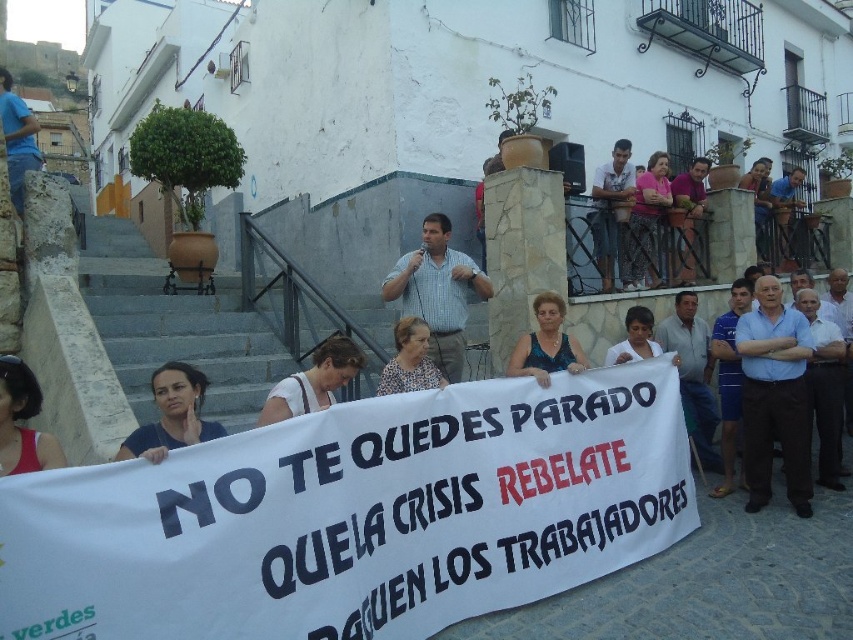
Can you confirm if checkered fabric shirt at center is shorter than matte red tank top at lower left?

No.

Is point (422, 278) positioned behind point (1, 371)?

Yes, it is behind point (1, 371).

You are a GUI agent. You are given a task and a screenshot of the screen. Output one action in this format:
    pyautogui.click(x=<x>, y=<y>)
    Task: Click on the checkered fabric shirt at center
    
    Given the screenshot: What is the action you would take?
    pyautogui.click(x=437, y=291)

The image size is (853, 640). I want to click on pink fabric at upper center, so click(x=646, y=220).

Does point (627, 264) come in front of point (413, 333)?

That is False.

The image size is (853, 640). Find the location of `pink fabric at upper center`. pink fabric at upper center is located at coordinates (646, 220).

Who is more forward, (457, 344) or (114, 458)?

Positioned in front is point (114, 458).

Can you confirm if checkered fabric shirt at center is positioned to the right of matte blue shirt at lower left?

Indeed, checkered fabric shirt at center is positioned on the right side of matte blue shirt at lower left.

Is point (459, 262) closer to viewer compared to point (183, 372)?

No, it is behind (183, 372).

Where is `checkered fabric shirt at center`? The width and height of the screenshot is (853, 640). checkered fabric shirt at center is located at coordinates (437, 291).